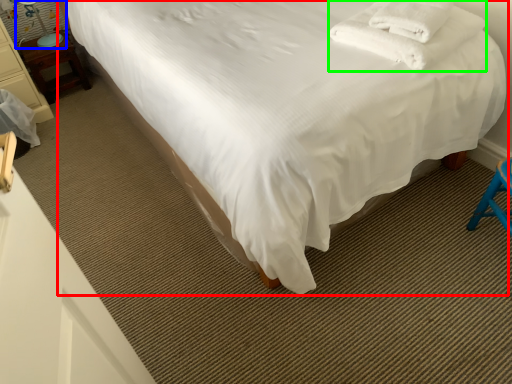
Question: Estimate the real-world distances between objects in this image. Which object is farther from bed (highlighted by a red box), table lamp (highlighted by a blue box) or blanket (highlighted by a green box)?

Choices:
 (A) table lamp
 (B) blanket

Answer: (A)